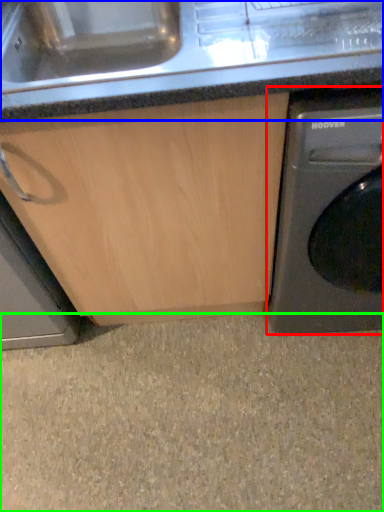
Question: Which object is positioned farthest from washing machine (highlighted by a red box)? Select from counter top (highlighted by a blue box) and granite (highlighted by a green box).

Choices:
 (A) counter top
 (B) granite

Answer: (B)